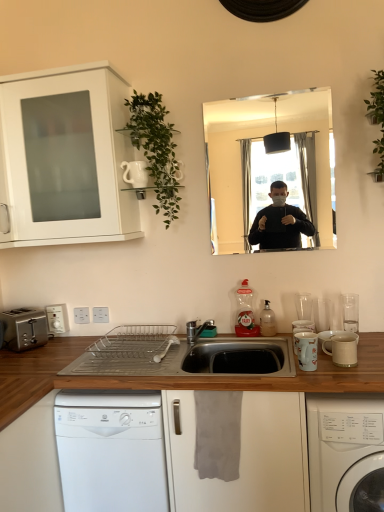
Where is `space that is in front of translucent plastic bottle at sink, the second bottle when ordered from right to left`? space that is in front of translucent plastic bottle at sink, the second bottle when ordered from right to left is located at coordinates (251, 342).